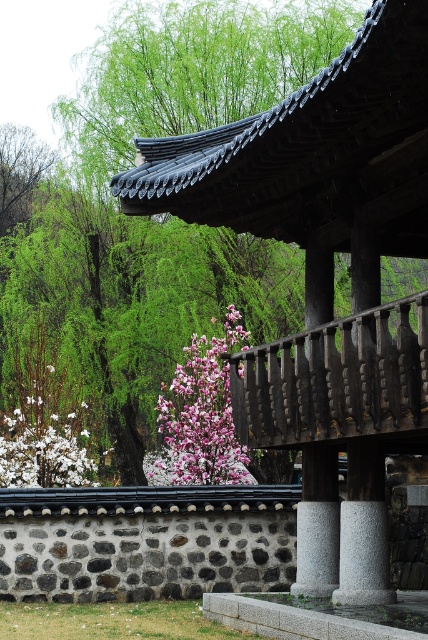
Which is above, pink glossy flower at center or white matte flower at lower left?

pink glossy flower at center is above.

Who is lower down, pink glossy flower at center or white matte flower at lower left?

white matte flower at lower left is lower down.

Measure the distance between point (216, 445) and camera.

Point (216, 445) and camera are 68.63 feet apart from each other.

The height and width of the screenshot is (640, 428). In order to click on pink glossy flower at center in this screenshot , I will do `click(201, 416)`.